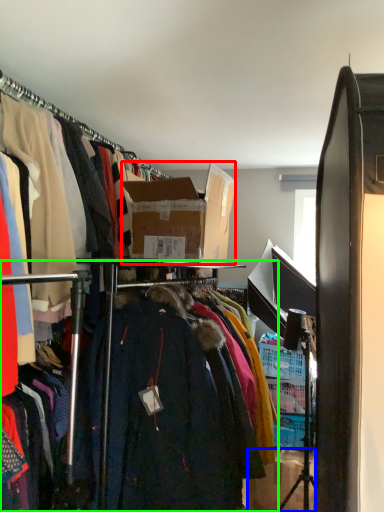
Question: Considering the real-world distances, which object is closest to box (highlighted by a red box)? box (highlighted by a blue box) or closet (highlighted by a green box).

Choices:
 (A) box
 (B) closet

Answer: (B)